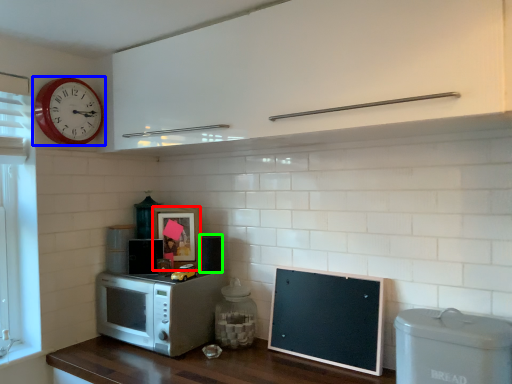
Question: Estimate the real-world distances between objects in this image. Which object is closer to picture frame (highlighted by a red box), wall clock (highlighted by a blue box) or appliance (highlighted by a green box)?

Choices:
 (A) wall clock
 (B) appliance

Answer: (B)